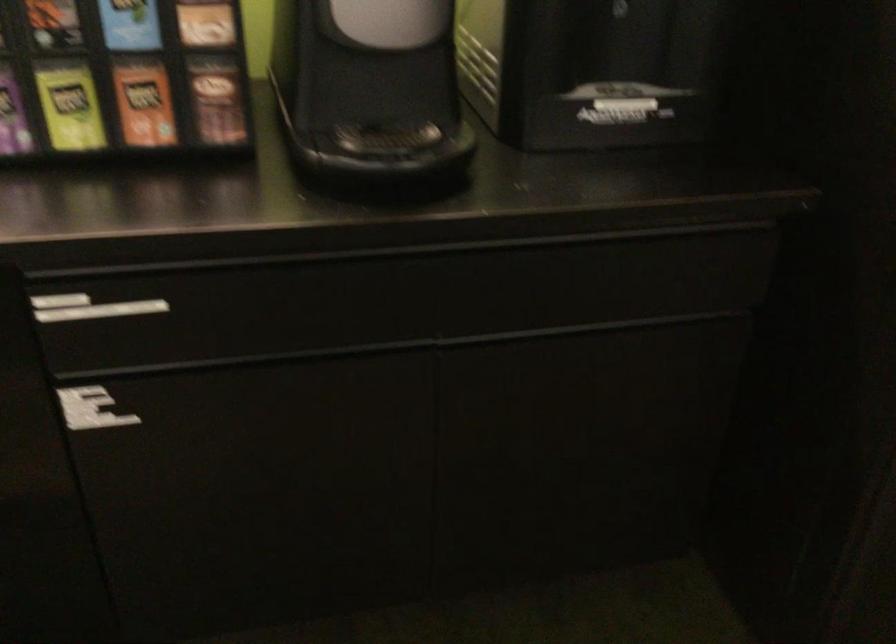
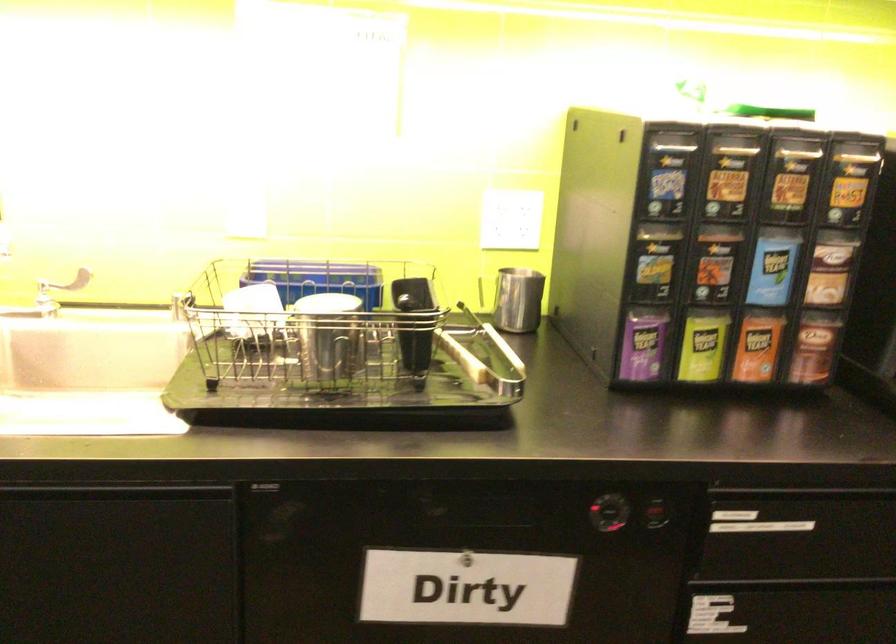
Question: Which direction would the cameraman need to move to produce the second image? Reply with the corresponding letter.

Choices:
 (A) Left
 (B) Right
 (C) Forward
 (D) Backward

Answer: (A)